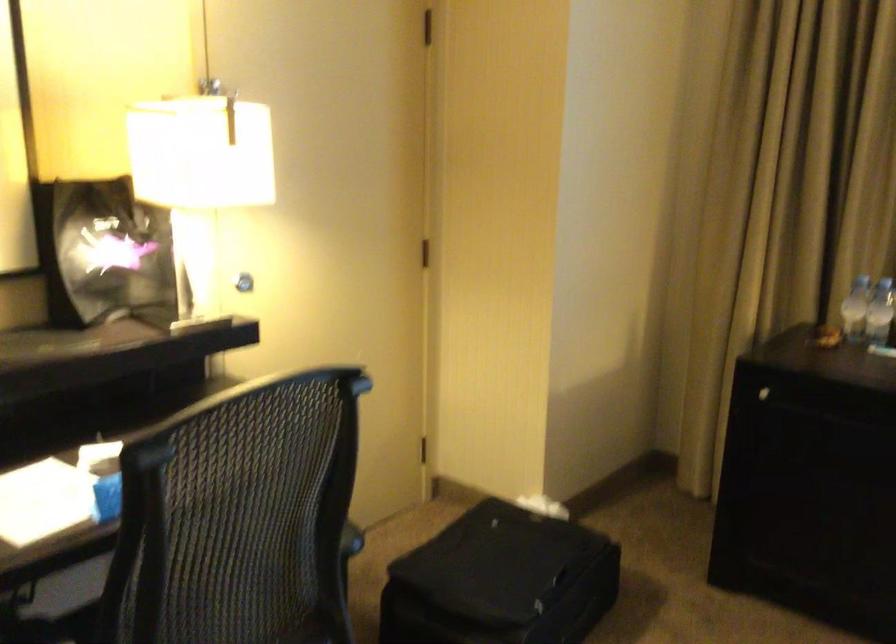
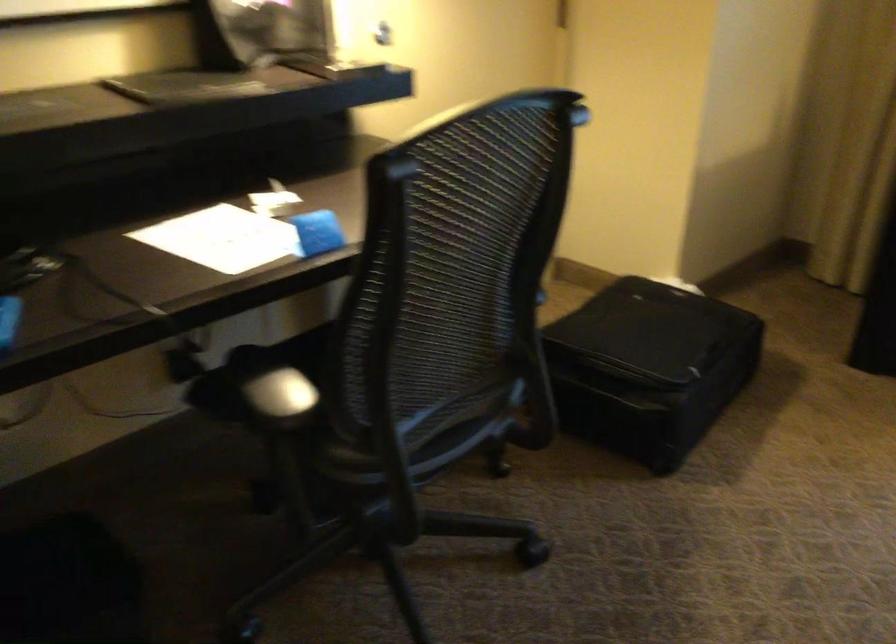
Question: Based on the continuous images, in which direction is the camera rotating? Reply with the corresponding letter.

Choices:
 (A) Left
 (B) Right
 (C) Up
 (D) Down

Answer: (D)